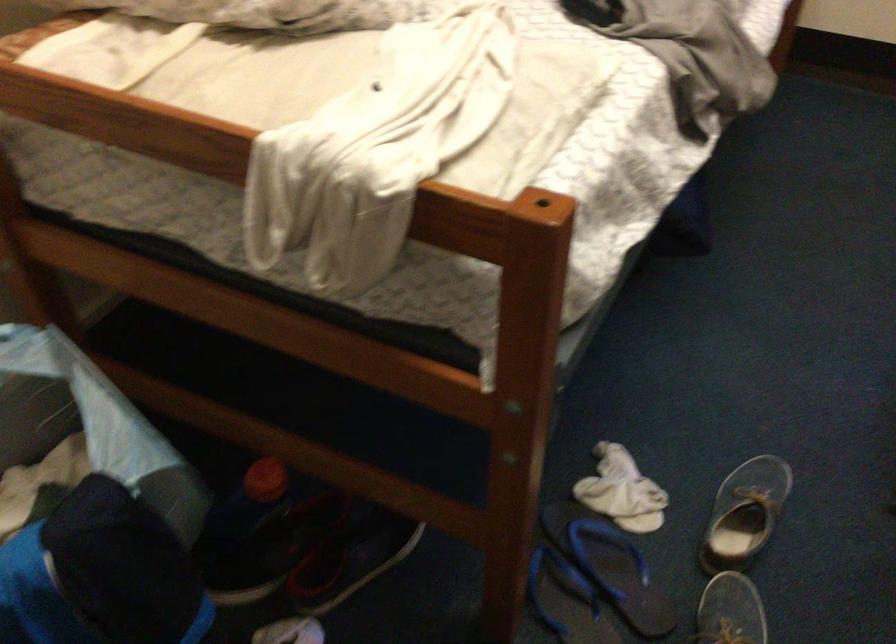
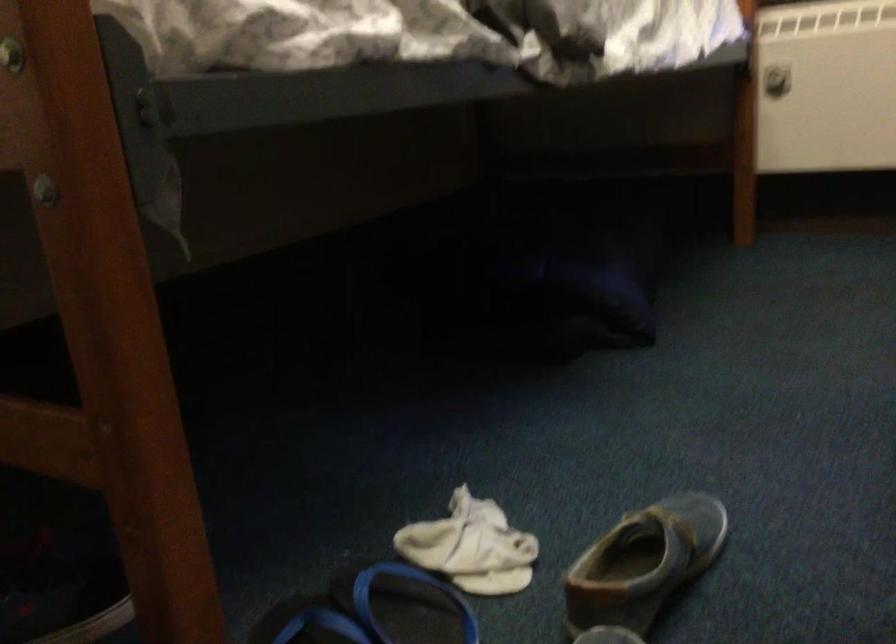
Where in the second image is the point corresponding to the point at 735,509 from the first image?

(643, 563)